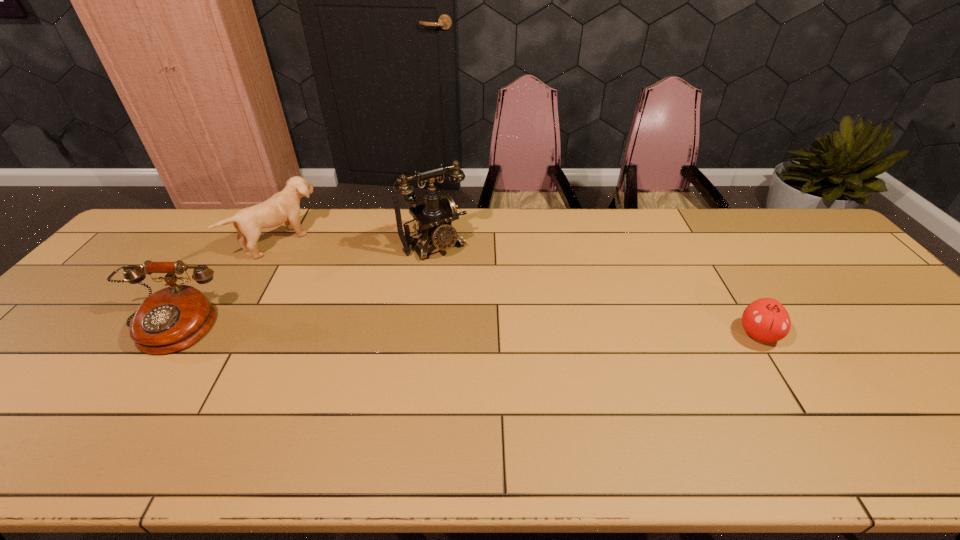
Image resolution: width=960 pixels, height=540 pixels. What are the coordinates of `free space that is in between the puppy and the taller telephone` in the screenshot? It's located at (358, 242).

Identify the location of vacant space that's between the third object from left to right and the rightmost object. The width and height of the screenshot is (960, 540). 596,289.

Locate an element on the screen. The height and width of the screenshot is (540, 960). vacant point located between the tallest object and the left telephone is located at coordinates (301, 286).

Select which object is the third closest to the farther telephone. Please provide its 2D coordinates. Your answer should be formatted as a tuple, i.e. [(x, y)], where the tuple contains the x and y coordinates of a point satisfying the conditions above.

[(766, 319)]

The width and height of the screenshot is (960, 540). I want to click on the closest object to the tallest object, so click(x=283, y=207).

Locate an element on the screen. Image resolution: width=960 pixels, height=540 pixels. vacant space that satisfies the following two spatial constraints: 1. on the front side of the shortest object; 2. on the right side of the farther telephone is located at coordinates (423, 334).

Identify the location of free region that satisfies the following two spatial constraints: 1. on the dial of the apple; 2. on the right side of the nearer telephone. (163, 334).

Image resolution: width=960 pixels, height=540 pixels. Find the location of `free location that satisfies the following two spatial constraints: 1. on the front side of the puppy; 2. on the left side of the second object from right to left`. free location that satisfies the following two spatial constraints: 1. on the front side of the puppy; 2. on the left side of the second object from right to left is located at coordinates pos(279,244).